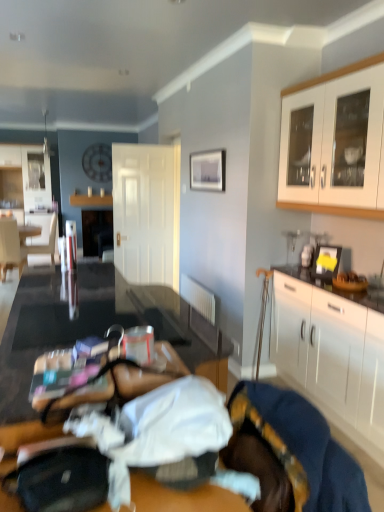
Question: Can you confirm if matte silver picture frame at upper center is wider than wooden table at lower left?

Choices:
 (A) yes
 (B) no

Answer: (B)

Question: Can you confirm if matte silver picture frame at upper center is smaller than wooden table at lower left?

Choices:
 (A) no
 (B) yes

Answer: (A)

Question: Can wooden table at lower left be found inside matte silver picture frame at upper center?

Choices:
 (A) no
 (B) yes

Answer: (A)

Question: Is matte silver picture frame at upper center to the right of wooden table at lower left from the viewer's perspective?

Choices:
 (A) yes
 (B) no

Answer: (A)

Question: Can you confirm if matte silver picture frame at upper center is bigger than wooden table at lower left?

Choices:
 (A) yes
 (B) no

Answer: (A)

Question: From the image's perspective, is matte silver picture frame at upper center beneath wooden table at lower left?

Choices:
 (A) no
 (B) yes

Answer: (A)

Question: From a real-world perspective, is white glossy cabinet at upper right, acting as the second cabinetry starting from the bottom, under white matte door at center?

Choices:
 (A) yes
 (B) no

Answer: (B)

Question: Can you confirm if white glossy cabinet at upper right, acting as the second cabinetry starting from the bottom, is shorter than white matte door at center?

Choices:
 (A) yes
 (B) no

Answer: (A)

Question: Considering the relative sizes of white glossy cabinet at upper right, which ranks as the 1th cabinetry in top-to-bottom order, and white matte door at center in the image provided, is white glossy cabinet at upper right, which ranks as the 1th cabinetry in top-to-bottom order, taller than white matte door at center?

Choices:
 (A) yes
 (B) no

Answer: (B)

Question: Is white glossy cabinet at upper right, which ranks as the 1th cabinetry in top-to-bottom order, beside white matte door at center?

Choices:
 (A) no
 (B) yes

Answer: (A)

Question: Considering the relative sizes of white glossy cabinet at upper right, which ranks as the 1th cabinetry in top-to-bottom order, and white matte door at center in the image provided, is white glossy cabinet at upper right, which ranks as the 1th cabinetry in top-to-bottom order, bigger than white matte door at center?

Choices:
 (A) yes
 (B) no

Answer: (A)

Question: From the image's perspective, is white glossy cabinet at upper right, which ranks as the 1th cabinetry in top-to-bottom order, located beneath white matte door at center?

Choices:
 (A) no
 (B) yes

Answer: (A)

Question: Considering the relative sizes of velvet blue blanket at lower right and white matte cabinet at right, which ranks as the second cabinetry in top-to-bottom order, in the image provided, is velvet blue blanket at lower right bigger than white matte cabinet at right, which ranks as the second cabinetry in top-to-bottom order,?

Choices:
 (A) yes
 (B) no

Answer: (B)